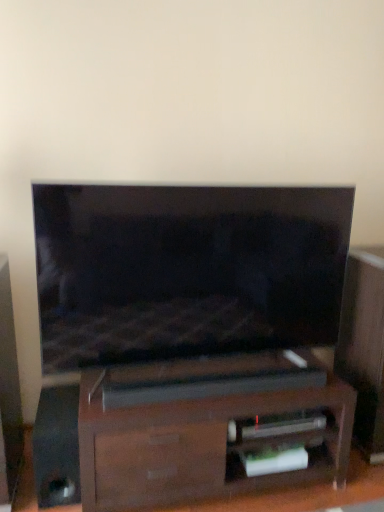
The image size is (384, 512). What do you see at coordinates (57, 447) in the screenshot? I see `black glossy speaker at lower left` at bounding box center [57, 447].

What do you see at coordinates (186, 270) in the screenshot? I see `matte black tv at center` at bounding box center [186, 270].

Locate an element on the screen. black glossy speaker at lower left is located at coordinates (57, 447).

Considering the sizes of objects black glossy speaker at lower left and matte black tv at center in the image provided, who is bigger, black glossy speaker at lower left or matte black tv at center?

matte black tv at center.

Based on their positions, is black glossy speaker at lower left located to the left or right of matte black tv at center?

black glossy speaker at lower left is positioned on matte black tv at center's left side.

Is black glossy speaker at lower left completely or partially outside of matte black tv at center?

Yes, black glossy speaker at lower left is not within matte black tv at center.

Is point (66, 444) closer or farther from the camera than point (188, 321)?

Point (66, 444) is positioned closer to the camera compared to point (188, 321).

Who is more distant, black glossy speaker at lower left or dark wood soundbar at center?

black glossy speaker at lower left is behind.

Is the surface of black glossy speaker at lower left in direct contact with dark wood soundbar at center?

No, black glossy speaker at lower left is not with dark wood soundbar at center.

How distant is black glossy speaker at lower left from dark wood soundbar at center?

black glossy speaker at lower left and dark wood soundbar at center are 20.56 inches apart from each other.

Does point (50, 451) lie behind point (291, 414)?

No, it is not.

You are a GUI agent. You are given a task and a screenshot of the screen. Output one action in this format:
    pyautogui.click(x=<x>, y=<y>)
    Task: Click on the furniture below the matte black tv at center (from a real-world perspective)
    
    Given the screenshot: What is the action you would take?
    pyautogui.click(x=206, y=434)

Based on the photo, from their relative heights in the image, would you say matte black tv at center is taller or shorter than dark wood soundbar at center?

Considering their sizes, matte black tv at center has more height than dark wood soundbar at center.

Consider the image. Considering the sizes of objects matte black tv at center and dark wood soundbar at center in the image provided, who is smaller, matte black tv at center or dark wood soundbar at center?

Smaller between the two is matte black tv at center.

Is black glossy speaker at lower left a part of dark wood soundbar at center?

No.

Can you confirm if dark wood soundbar at center is shorter than black glossy speaker at lower left?

No, dark wood soundbar at center is not shorter than black glossy speaker at lower left.

From the image's perspective, would you say dark wood soundbar at center is positioned over black glossy speaker at lower left?

Yes, from the image's perspective, dark wood soundbar at center is over black glossy speaker at lower left.

Is point (99, 445) closer to viewer compared to point (68, 471)?

That is True.

Does matte black tv at center have a smaller size compared to black glossy speaker at lower left?

Incorrect, matte black tv at center is not smaller in size than black glossy speaker at lower left.

Considering the points (167, 269) and (48, 455), which point is behind, point (167, 269) or point (48, 455)?

The point (167, 269) is farther from the camera.

Does matte black tv at center turn towards black glossy speaker at lower left?

No, matte black tv at center is not oriented towards black glossy speaker at lower left.

Identify the location of television that is above the black glossy speaker at lower left (from a real-world perspective). The height and width of the screenshot is (512, 384). (186, 270).

Between dark wood soundbar at center and matte black tv at center, which one appears on the left side from the viewer's perspective?

matte black tv at center.

Can you confirm if dark wood soundbar at center is taller than matte black tv at center?

Incorrect, the height of dark wood soundbar at center is not larger of that of matte black tv at center.

Is matte black tv at center at the back of dark wood soundbar at center?

dark wood soundbar at center is not turned away from matte black tv at center.

You are a GUI agent. You are given a task and a screenshot of the screen. Output one action in this format:
    pyautogui.click(x=<x>, y=<y>)
    Task: Click on the speaker on the left of the matte black tv at center
    This screenshot has width=384, height=512.
    Given the screenshot: What is the action you would take?
    pyautogui.click(x=57, y=447)

Identify the location of furniture in front of the black glossy speaker at lower left. This screenshot has width=384, height=512. (206, 434).

Considering their positions, is black glossy speaker at lower left positioned further to dark wood soundbar at center than matte black tv at center?

black glossy speaker at lower left is positioned further to the anchor dark wood soundbar at center.

Considering their positions, is dark wood soundbar at center positioned closer to matte black tv at center than black glossy speaker at lower left?

dark wood soundbar at center is positioned closer to the anchor matte black tv at center.

Looking at the image, which one is located closer to matte black tv at center, black glossy speaker at lower left or dark wood soundbar at center?

Among the two, dark wood soundbar at center is located nearer to matte black tv at center.

Which object lies further to the anchor point black glossy speaker at lower left, dark wood soundbar at center or matte black tv at center?

matte black tv at center is further to black glossy speaker at lower left.

Which object lies further to the anchor point black glossy speaker at lower left, matte black tv at center or dark wood soundbar at center?

matte black tv at center is positioned further to the anchor black glossy speaker at lower left.

From the image, which object appears to be nearer to dark wood soundbar at center, matte black tv at center or black glossy speaker at lower left?

matte black tv at center is positioned closer to the anchor dark wood soundbar at center.

Where is `furniture that lies between matte black tv at center and black glossy speaker at lower left from top to bottom`? This screenshot has height=512, width=384. furniture that lies between matte black tv at center and black glossy speaker at lower left from top to bottom is located at coordinates (206, 434).